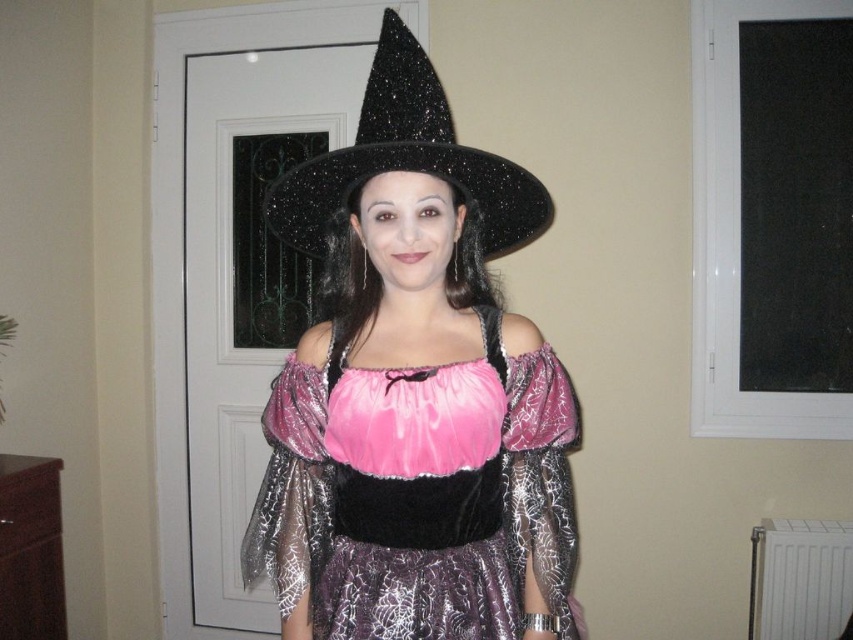
Is pink satin dress at center wider than black glittery witch hat at center?

Indeed, pink satin dress at center has a greater width compared to black glittery witch hat at center.

Does point (408, 486) come in front of point (512, 168)?

No, it is behind (512, 168).

What do you see at coordinates (419, 496) in the screenshot? I see `pink satin dress at center` at bounding box center [419, 496].

At what (x,y) coordinates should I click in order to perform the action: click on pink satin dress at center. Please return your answer as a coordinate pair (x, y). Looking at the image, I should click on (419, 496).